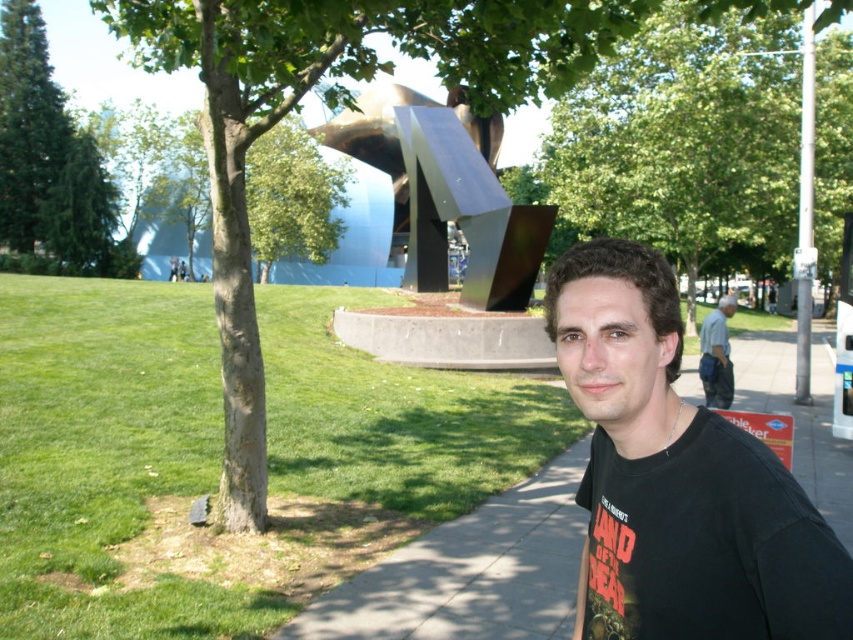
You are standing at the point closest to the camera in the scene. Which point, point [689,120] or point [717,320], are you currently at?

You are at point [689,120] because it is further to the viewer than point [717,320].

Consider the image. You are a photographer trying to capture the green leafy tree at upper center and the gray fabric bag at lower right in the same frame. Based on their positions, which object should you adjust your camera to focus on first to ensure both are in the frame?

The green leafy tree at upper center is positioned on the left side of the gray fabric bag at lower right, so you should focus on the green leafy tree at upper center first to ensure both are included in the frame.

You are taking a photo of the black matte shirt at center and the green leafy tree at upper center. Which object should you focus on first if you want both to be in sharp focus?

The black matte shirt at center is smaller than the green leafy tree at upper center, so you should focus on the green leafy tree at upper center first to ensure both are in sharp focus.